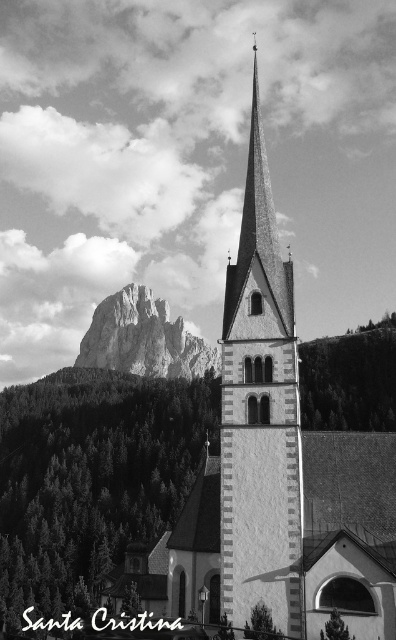
You are a photographer planning to capture the church and mountain in a single shot. Given that the white stone tower at center and the rugged stone mountain at center are both in the frame, which one appears taller in the photograph?

The white stone tower at center appears taller than the rugged stone mountain at center in the photograph because the description states that the white stone tower at center has a greater height compared to rugged stone mountain at center.

You are a photographer planning to capture the white stone tower at center and the rugged stone mountain at center in a single frame. Given their sizes, which one will appear more prominent in the photo?

The white stone tower at center will appear more prominent in the photo because it has a larger size compared to the rugged stone mountain at center.